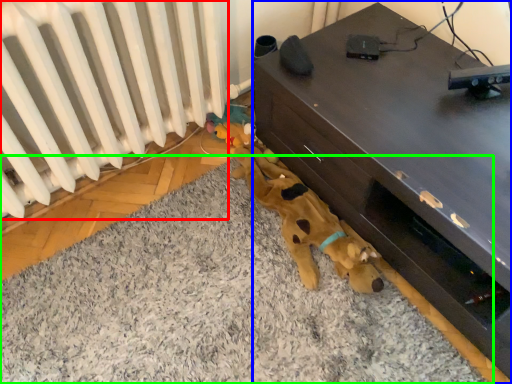
Question: Which is farther away from radiator (highlighted by a red box)? furniture (highlighted by a blue box) or mat (highlighted by a green box)?

Choices:
 (A) furniture
 (B) mat

Answer: (A)